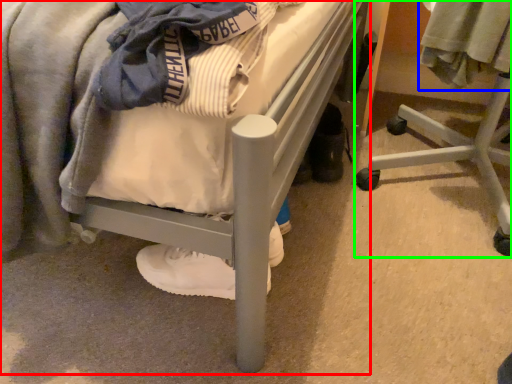
Question: Which is farther away from bed (highlighted by a red box)? clothing (highlighted by a blue box) or furniture (highlighted by a green box)?

Choices:
 (A) clothing
 (B) furniture

Answer: (B)